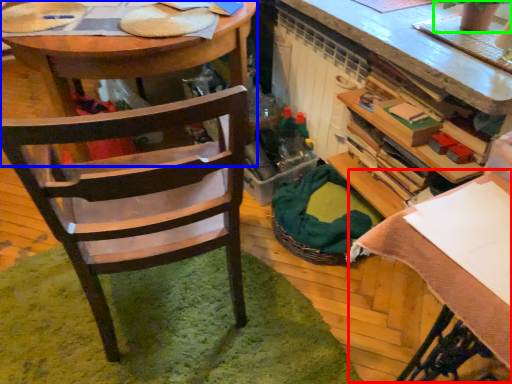
Question: Considering the real-world distances, which object is closest to table (highlighted by a red box)? desk (highlighted by a blue box) or houseplant (highlighted by a green box).

Choices:
 (A) desk
 (B) houseplant

Answer: (B)